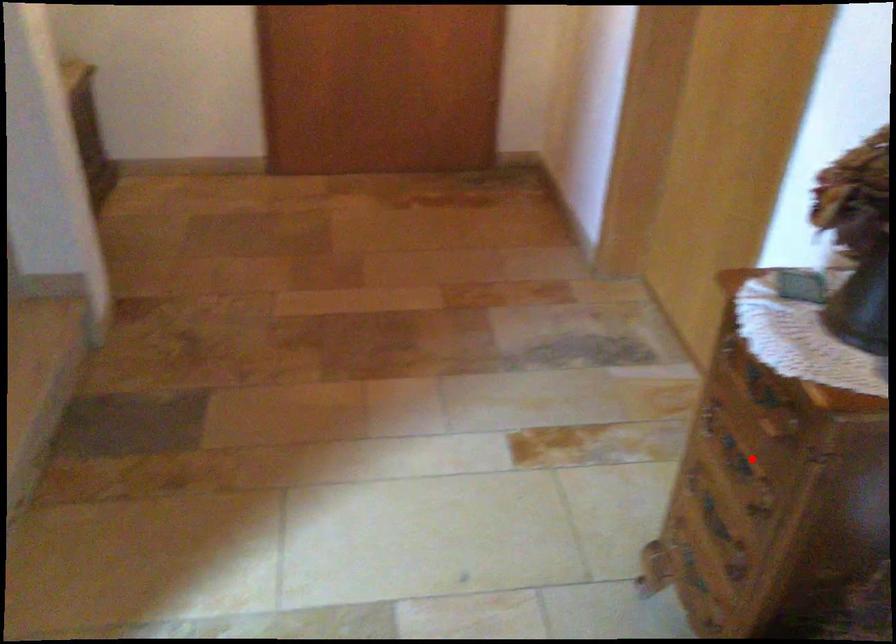
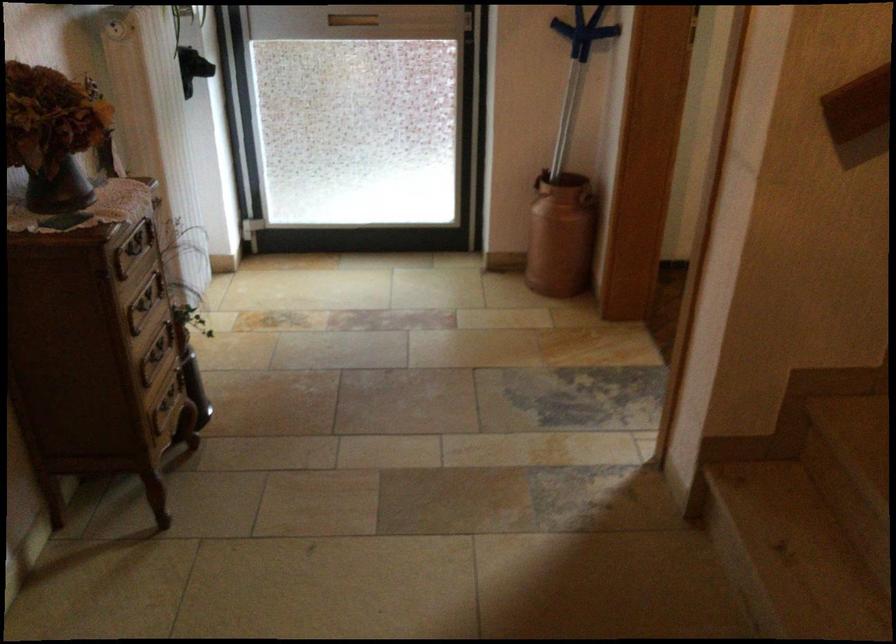
Question: I am providing you with two images of the same scene from different viewpoints. Given a red point in image1, look at the same physical point in image2. Is it:

Choices:
 (A) Closer to the viewpoint
 (B) Farther from the viewpoint

Answer: (B)